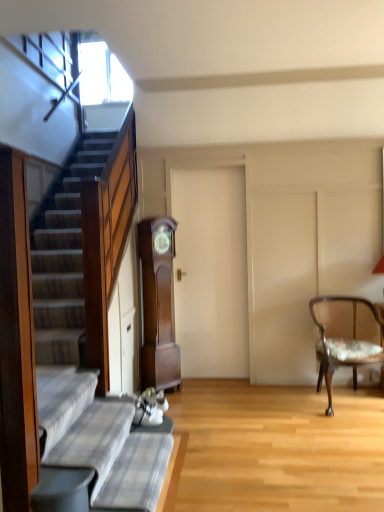
Measure the distance between brown wood grandfather clock at center and camera.

brown wood grandfather clock at center is 3.60 meters away from camera.

I want to click on brown wood grandfather clock at center, so click(158, 304).

Do you think plaid fabric couch at lower left is within brown wood grandfather clock at center, or outside of it?

The correct answer is: outside.

Is point (121, 399) closer or farther from the camera than point (148, 338)?

Clearly, point (121, 399) is closer to the camera than point (148, 338).

From a real-world perspective, is plaid fabric couch at lower left positioned above or below brown wood grandfather clock at center?

In terms of real-world spatial position, plaid fabric couch at lower left is below brown wood grandfather clock at center.

Is wooden cane chair with floral cushion at right wider or thinner than plaid fabric couch at lower left?

Considering their sizes, wooden cane chair with floral cushion at right looks broader than plaid fabric couch at lower left.

Considering their positions, is wooden cane chair with floral cushion at right located in front of or behind plaid fabric couch at lower left?

Visually, wooden cane chair with floral cushion at right is located behind plaid fabric couch at lower left.

Is wooden cane chair with floral cushion at right taller than plaid fabric couch at lower left?

Yes.

How far apart are wooden cane chair with floral cushion at right and plaid fabric couch at lower left?

wooden cane chair with floral cushion at right and plaid fabric couch at lower left are 5.74 feet apart from each other.

Is brown wood grandfather clock at center oriented away from wooden cane chair with floral cushion at right?

No.

In order to click on chair in front of the brown wood grandfather clock at center in this screenshot , I will do `click(345, 337)`.

Is brown wood grandfather clock at center at the left side of wooden cane chair with floral cushion at right?

Yes.

Does wooden cane chair with floral cushion at right turn towards brown wood grandfather clock at center?

No, wooden cane chair with floral cushion at right does not turn towards brown wood grandfather clock at center.

Would you consider wooden cane chair with floral cushion at right to be distant from brown wood grandfather clock at center?

Absolutely, wooden cane chair with floral cushion at right is distant from brown wood grandfather clock at center.

Is wooden cane chair with floral cushion at right positioned in front of brown wood grandfather clock at center?

Yes, it is in front of brown wood grandfather clock at center.

From a real-world perspective, is wooden cane chair with floral cushion at right positioned under brown wood grandfather clock at center based on gravity?

Yes, from a real-world perspective, wooden cane chair with floral cushion at right is below brown wood grandfather clock at center.

Where is `chair that is above the plaid fabric couch at lower left (from the image's perspective)`? The image size is (384, 512). chair that is above the plaid fabric couch at lower left (from the image's perspective) is located at coordinates (345, 337).

Which object is closer to the camera, plaid fabric couch at lower left or wooden cane chair with floral cushion at right?

Positioned in front is plaid fabric couch at lower left.

Can you tell me how much plaid fabric couch at lower left and wooden cane chair with floral cushion at right differ in facing direction?

plaid fabric couch at lower left and wooden cane chair with floral cushion at right are facing 79.2 degrees away from each other.

Is plaid fabric couch at lower left not inside wooden cane chair with floral cushion at right?

Absolutely, plaid fabric couch at lower left is external to wooden cane chair with floral cushion at right.

Considering the relative sizes of brown wood grandfather clock at center and plaid fabric couch at lower left in the image provided, is brown wood grandfather clock at center thinner than plaid fabric couch at lower left?

Yes.

At what (x,y) coordinates should I click in order to perform the action: click on couch in front of the brown wood grandfather clock at center. Please return your answer as a coordinate pair (x, y). The width and height of the screenshot is (384, 512). Looking at the image, I should click on (98, 442).

From the image's perspective, would you say brown wood grandfather clock at center is positioned over plaid fabric couch at lower left?

Correct, brown wood grandfather clock at center appears higher than plaid fabric couch at lower left in the image.

Consider the image. Who is bigger, brown wood grandfather clock at center or plaid fabric couch at lower left?

brown wood grandfather clock at center.

Where is `couch located on the left of brown wood grandfather clock at center`? This screenshot has height=512, width=384. couch located on the left of brown wood grandfather clock at center is located at coordinates (98, 442).

At what (x,y) coordinates should I click in order to perform the action: click on couch located in front of the wooden cane chair with floral cushion at right. Please return your answer as a coordinate pair (x, y). Looking at the image, I should click on (98, 442).

From the image, which object appears to be nearer to wooden cane chair with floral cushion at right, plaid fabric couch at lower left or brown wood grandfather clock at center?

brown wood grandfather clock at center is closer to wooden cane chair with floral cushion at right.

Looking at the image, which one is located closer to wooden cane chair with floral cushion at right, brown wood grandfather clock at center or plaid fabric couch at lower left?

brown wood grandfather clock at center lies closer to wooden cane chair with floral cushion at right than the other object.

Looking at the image, which one is located further to plaid fabric couch at lower left, brown wood grandfather clock at center or wooden cane chair with floral cushion at right?

The object further to plaid fabric couch at lower left is wooden cane chair with floral cushion at right.

When comparing their distances from brown wood grandfather clock at center, does plaid fabric couch at lower left or wooden cane chair with floral cushion at right seem further?

Based on the image, plaid fabric couch at lower left appears to be further to brown wood grandfather clock at center.

When comparing their distances from brown wood grandfather clock at center, does wooden cane chair with floral cushion at right or plaid fabric couch at lower left seem closer?

wooden cane chair with floral cushion at right is closer to brown wood grandfather clock at center.

Based on their spatial positions, is wooden cane chair with floral cushion at right or brown wood grandfather clock at center closer to plaid fabric couch at lower left?

Among the two, brown wood grandfather clock at center is located nearer to plaid fabric couch at lower left.

Identify the location of cabinetry between plaid fabric couch at lower left and wooden cane chair with floral cushion at right in the horizontal direction. (158, 304).